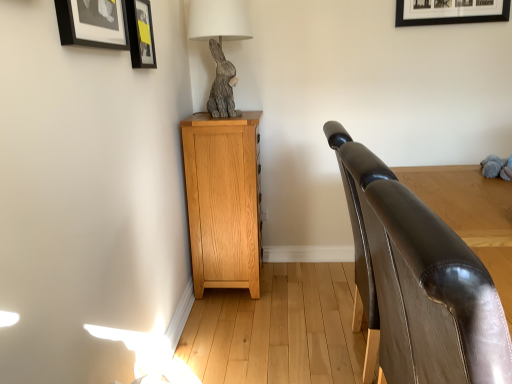
Find the location of a particular element. free location in front of light oak cabinet at left is located at coordinates (244, 322).